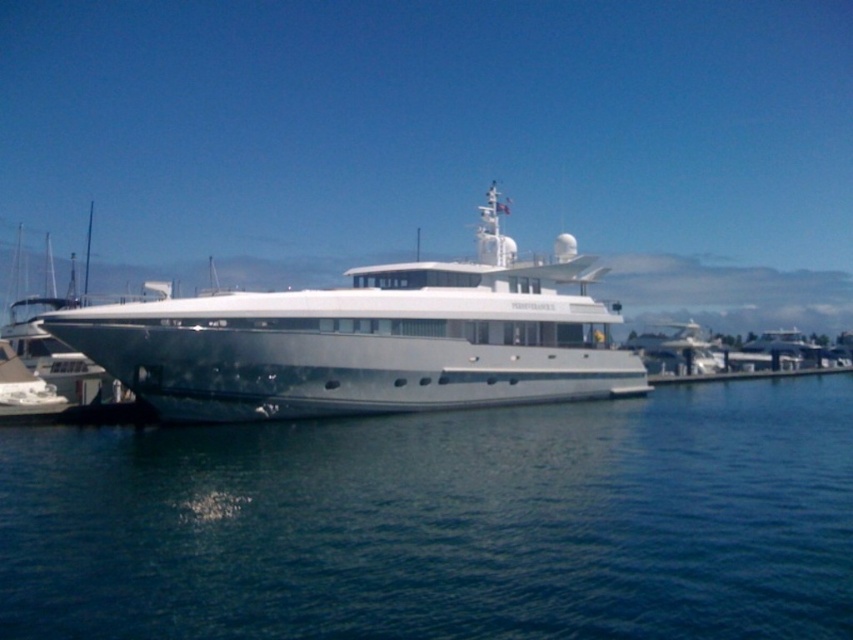
Is point (563, 605) positioned behind point (387, 396)?

No, it is not.

The image size is (853, 640). What do you see at coordinates (444, 524) in the screenshot?
I see `blue water at center` at bounding box center [444, 524].

Where is `blue water at center`? blue water at center is located at coordinates (444, 524).